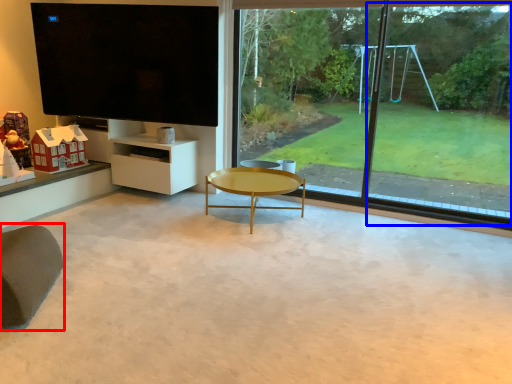
Question: Which object is further to the camera taking this photo, swivel chair (highlighted by a red box) or window frame (highlighted by a blue box)?

Choices:
 (A) swivel chair
 (B) window frame

Answer: (B)